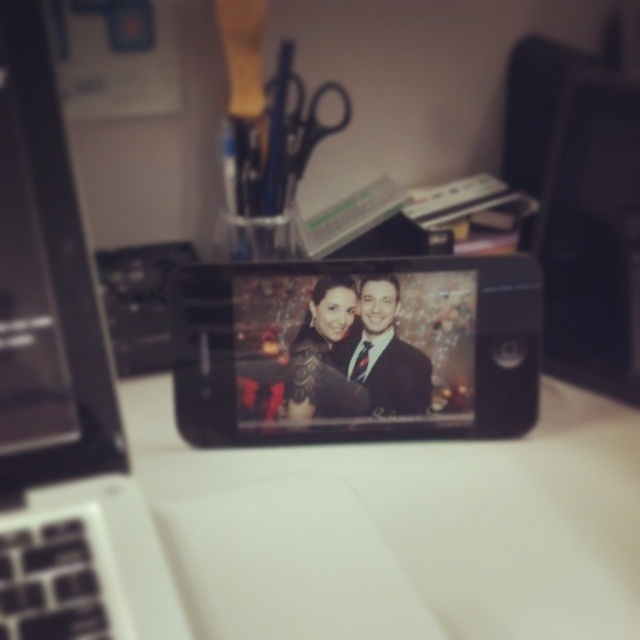
Question: Which point is farther to the camera?

Choices:
 (A) black metallic scissors at upper center
 (B) white matte table at center

Answer: (A)

Question: Can you confirm if matte black suit at center is positioned to the left of black metallic scissors at upper center?

Choices:
 (A) no
 (B) yes

Answer: (A)

Question: Which object appears closest to the camera in this image?

Choices:
 (A) black glossy phone at center
 (B) black metallic scissors at upper center
 (C) black plastic laptop at left
 (D) white matte table at center

Answer: (C)

Question: Does black plastic laptop at left have a larger size compared to black glossy phone at center?

Choices:
 (A) yes
 (B) no

Answer: (A)

Question: Which point is farther to the camera?

Choices:
 (A) black glossy phone at center
 (B) black plastic laptop at left

Answer: (A)

Question: Is black plastic laptop at left positioned before matte black suit at center?

Choices:
 (A) yes
 (B) no

Answer: (A)